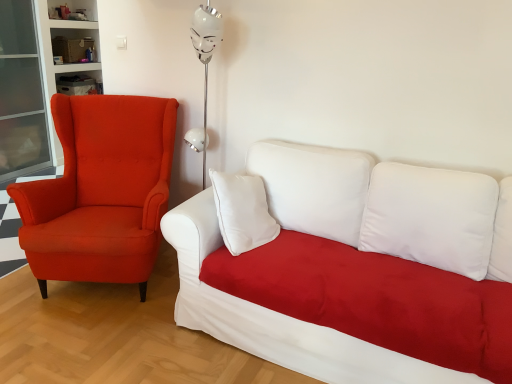
Question: From the image's perspective, is white fabric couch at center above matte orange armchair at left?

Choices:
 (A) yes
 (B) no

Answer: (B)

Question: Can you confirm if white fabric couch at center is positioned to the left of matte orange armchair at left?

Choices:
 (A) no
 (B) yes

Answer: (A)

Question: Are white fabric couch at center and matte orange armchair at left far apart?

Choices:
 (A) yes
 (B) no

Answer: (B)

Question: Does white fabric couch at center have a lesser height compared to matte orange armchair at left?

Choices:
 (A) no
 (B) yes

Answer: (B)

Question: Can you confirm if white fabric couch at center is smaller than matte orange armchair at left?

Choices:
 (A) yes
 (B) no

Answer: (B)

Question: Can you confirm if white fabric couch at center is thinner than matte orange armchair at left?

Choices:
 (A) yes
 (B) no

Answer: (B)

Question: From a real-world perspective, is matte orange armchair at left located beneath white fabric couch at center?

Choices:
 (A) no
 (B) yes

Answer: (A)

Question: Is matte orange armchair at left facing away from white fabric couch at center?

Choices:
 (A) no
 (B) yes

Answer: (A)

Question: From a real-world perspective, is matte orange armchair at left over white fabric couch at center?

Choices:
 (A) yes
 (B) no

Answer: (A)

Question: Is matte orange armchair at left behind white fabric couch at center?

Choices:
 (A) no
 (B) yes

Answer: (B)

Question: From the image's perspective, is matte orange armchair at left on top of white fabric couch at center?

Choices:
 (A) no
 (B) yes

Answer: (B)

Question: Considering the relative sizes of matte orange armchair at left and white fabric couch at center in the image provided, is matte orange armchair at left bigger than white fabric couch at center?

Choices:
 (A) no
 (B) yes

Answer: (A)

Question: Based on their sizes in the image, would you say matte orange armchair at left is bigger or smaller than white fabric couch at center?

Choices:
 (A) big
 (B) small

Answer: (B)